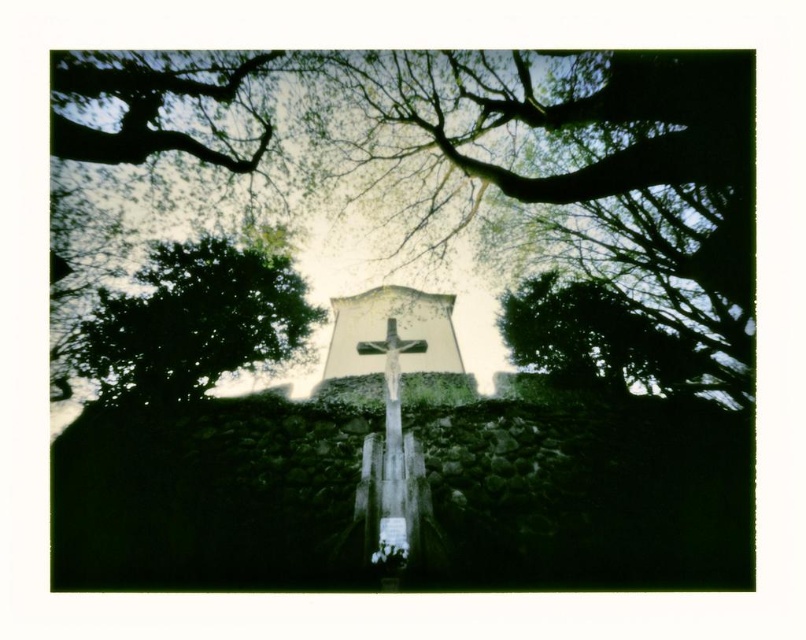
Question: From the image, what is the correct spatial relationship of green leafy tree at center in relation to white matte cross at center?

Choices:
 (A) below
 (B) above

Answer: (B)

Question: Is green leafy tree at upper center to the right of wooden cross at center from the viewer's perspective?

Choices:
 (A) no
 (B) yes

Answer: (B)

Question: Is green leafy tree at upper left smaller than green leafy tree at upper center?

Choices:
 (A) no
 (B) yes

Answer: (B)

Question: Which of these objects is positioned farthest from the green leafy tree at upper left?

Choices:
 (A) white matte cross at center
 (B) wooden cross at center
 (C) green leafy tree at upper center
 (D) green leafy tree at center

Answer: (C)

Question: Which object is positioned closest to the green leafy tree at upper left?

Choices:
 (A) green leafy tree at center
 (B) wooden cross at center

Answer: (A)

Question: Which of the following is the farthest from the observer?

Choices:
 (A) pyautogui.click(x=659, y=388)
 (B) pyautogui.click(x=391, y=298)
 (C) pyautogui.click(x=726, y=161)

Answer: (B)